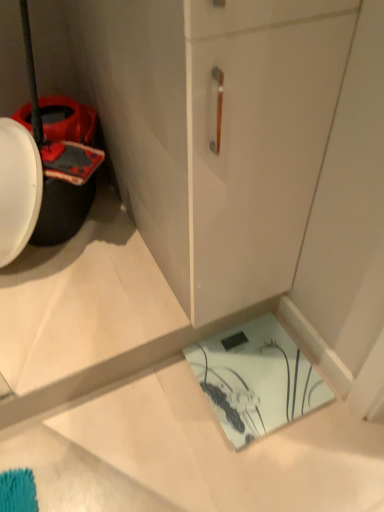
Find the location of a particular element. empty space that is ontop of transparent glass scale at lower center (from a real-world perspective) is located at coordinates coord(258,374).